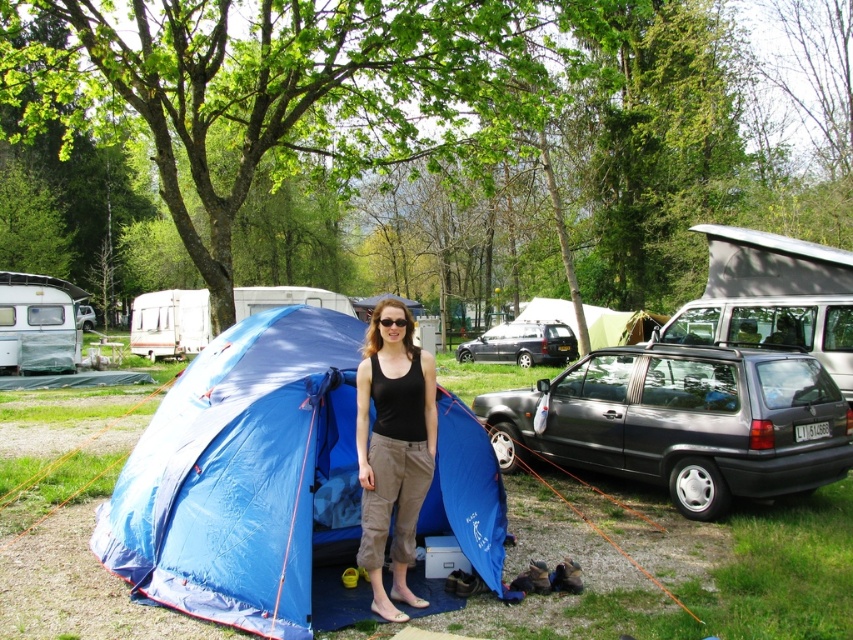
You are a hiker who wants to set up a new tent near the existing blue fabric tent at center and the matte gray hatchback at right. Based on their current positions, which object is closer to you if you are standing at the edge of the campsite?

The blue fabric tent at center is closer to you because it is positioned over the matte gray hatchback at right, meaning it is nearer to your current position at the edge of the campsite.

You are a hiker who needs to decide which car to use to carry your camping gear. You see the matte gray hatchback at right and the metallic gray hatchback at center. Which car has a longer length?

A: The metallic gray hatchback at center is longer than the matte gray hatchback at right, so you should choose the metallic gray hatchback at center for carrying your camping gear since it has more space.

You are standing at the campsite and want to take a photo of the blue fabric tent at center. If your camera has a maximum focus range of 4 meters, will you need to move closer to the tent to get a clear photo?

The blue fabric tent at center is 4.12 meters from viewer, so you need to move closer to ensure the camera can focus properly since it exceeds the 4 meter limit.